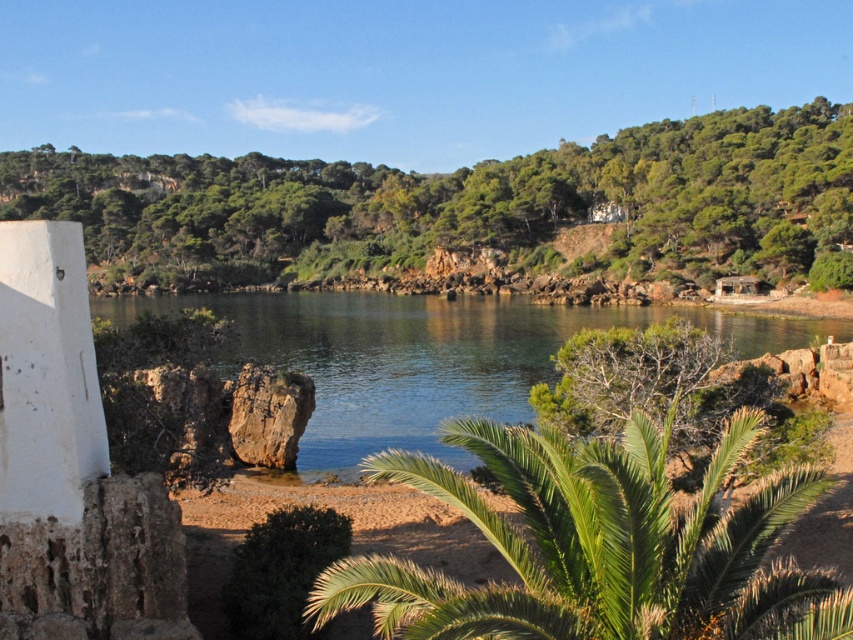
You are standing on the beach and want to take a photo that includes both the green leafy palm tree at center and the clear water at center. Which object will appear wider in the photo?

The clear water at center will appear wider in the photo because the green leafy palm tree at center is narrower than it.

You are standing on the beach and want to take a photo of the green leafy palm tree at center and the clear water at center. Which object will appear larger in the photo?

The clear water at center will appear larger in the photo because it is taller than the green leafy palm tree at center.